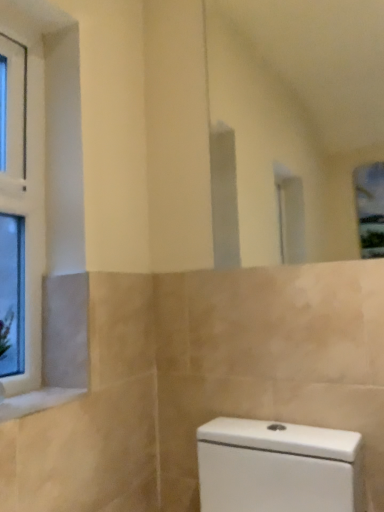
Question: Should I look upward or downward to see white glass window at left?

Choices:
 (A) up
 (B) down

Answer: (A)

Question: Is white glass window at left at the right side of white marble window sill at lower left?

Choices:
 (A) no
 (B) yes

Answer: (A)

Question: Is white glass window at left shorter than white marble window sill at lower left?

Choices:
 (A) yes
 (B) no

Answer: (B)

Question: From a real-world perspective, is white glass window at left on top of white marble window sill at lower left?

Choices:
 (A) yes
 (B) no

Answer: (A)

Question: Considering the relative sizes of white glass window at left and white marble window sill at lower left in the image provided, is white glass window at left smaller than white marble window sill at lower left?

Choices:
 (A) no
 (B) yes

Answer: (A)

Question: Is white glass window at left far away from white marble window sill at lower left?

Choices:
 (A) yes
 (B) no

Answer: (B)

Question: Can you confirm if white glass window at left is positioned to the left of white marble window sill at lower left?

Choices:
 (A) yes
 (B) no

Answer: (A)

Question: Can you confirm if white marble window sill at lower left is thinner than white glass window at left?

Choices:
 (A) no
 (B) yes

Answer: (A)

Question: Does white marble window sill at lower left appear on the right side of white glass window at left?

Choices:
 (A) no
 (B) yes

Answer: (B)

Question: Considering the relative sizes of white marble window sill at lower left and white glass window at left in the image provided, is white marble window sill at lower left shorter than white glass window at left?

Choices:
 (A) yes
 (B) no

Answer: (A)

Question: Would you say white marble window sill at lower left is a long distance from white glass window at left?

Choices:
 (A) no
 (B) yes

Answer: (A)

Question: Considering the relative positions of white marble window sill at lower left and white glass window at left in the image provided, is white marble window sill at lower left in front of white glass window at left?

Choices:
 (A) no
 (B) yes

Answer: (B)

Question: Is white marble window sill at lower left to the left of white glass window at left from the viewer's perspective?

Choices:
 (A) yes
 (B) no

Answer: (B)

Question: Is white glass window at left taller or shorter than white marble window sill at lower left?

Choices:
 (A) tall
 (B) short

Answer: (A)